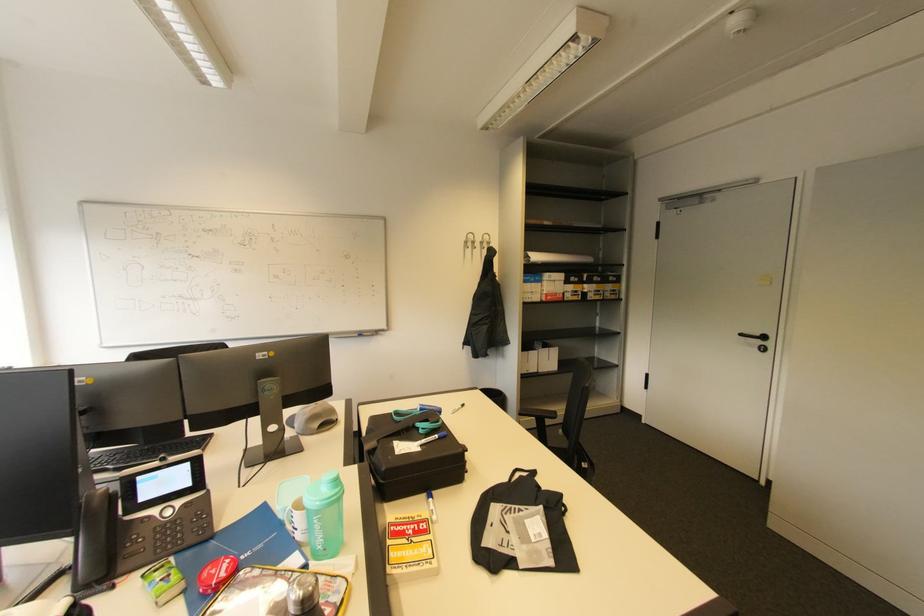
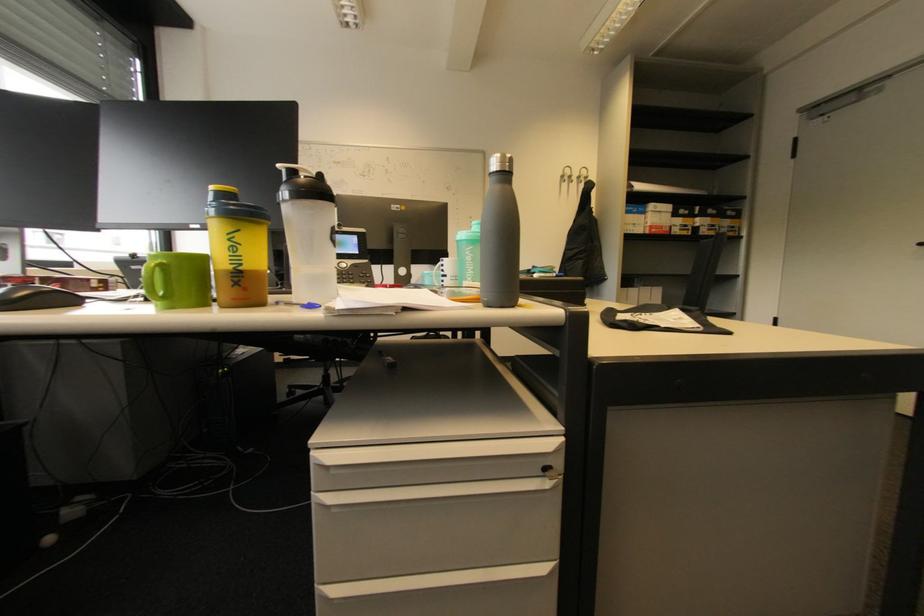
Find the pixel in the second image that matches (x=470, y=243) in the first image.

(567, 177)